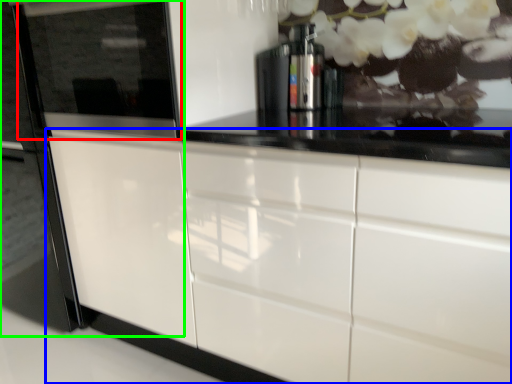
Question: Which object is positioned closest to appliance (highlighted by a red box)? Select from cabinetry (highlighted by a blue box) and fridge (highlighted by a green box).

Choices:
 (A) cabinetry
 (B) fridge

Answer: (B)